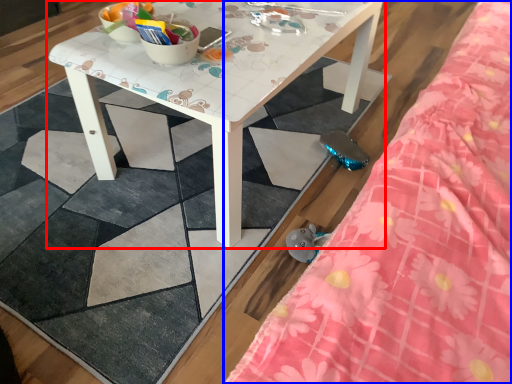
Question: Which of the following is the closest to the observer, table (highlighted by a red box) or bed (highlighted by a blue box)?

Choices:
 (A) table
 (B) bed

Answer: (B)